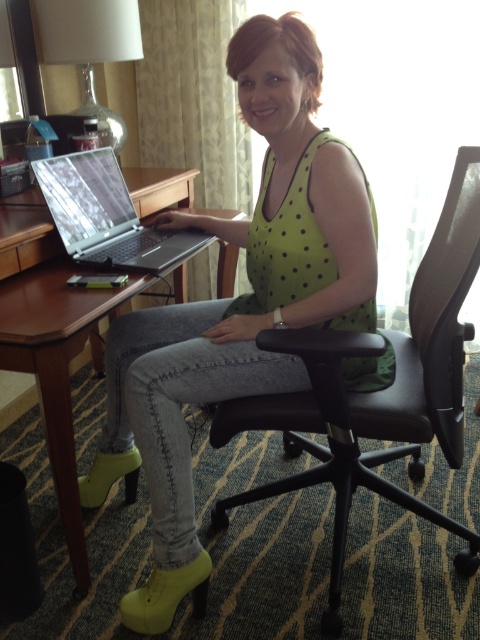
Question: Which point is closer to the camera taking this photo?

Choices:
 (A) (440, 284)
 (B) (108, 369)
 (C) (225, 275)

Answer: (A)

Question: Can you confirm if green polka dot tank top at center is thinner than silver metallic laptop at center?

Choices:
 (A) yes
 (B) no

Answer: (B)

Question: Is green polka dot tank top at center closer to camera compared to black leather swivel chair at center?

Choices:
 (A) no
 (B) yes

Answer: (A)

Question: Does green polka dot tank top at center come behind silver metallic laptop at center?

Choices:
 (A) yes
 (B) no

Answer: (B)

Question: Which of the following is the farthest from the observer?

Choices:
 (A) silver metallic laptop at center
 (B) brown wood table at left
 (C) black leather swivel chair at center

Answer: (A)

Question: Which point is farther from the camera taking this photo?

Choices:
 (A) (22, 220)
 (B) (291, 108)
 (C) (68, 216)

Answer: (C)